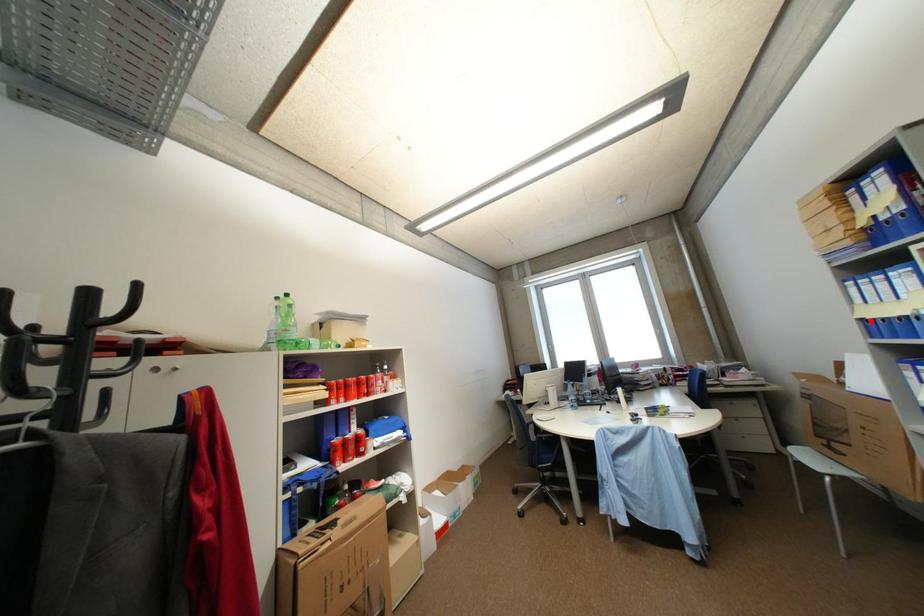
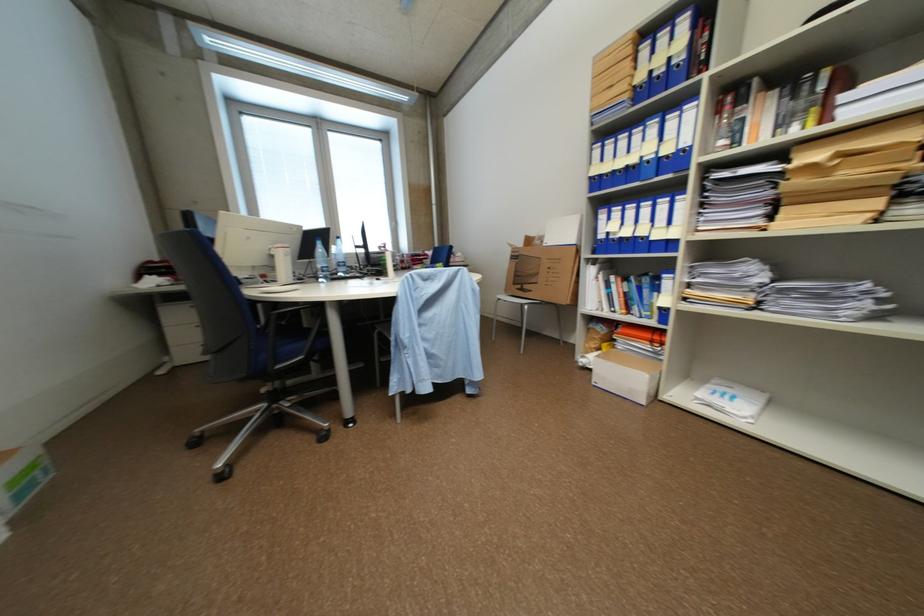
The point at the highlighted location is marked in the first image. Where is the corresponding point in the second image?

(600, 180)